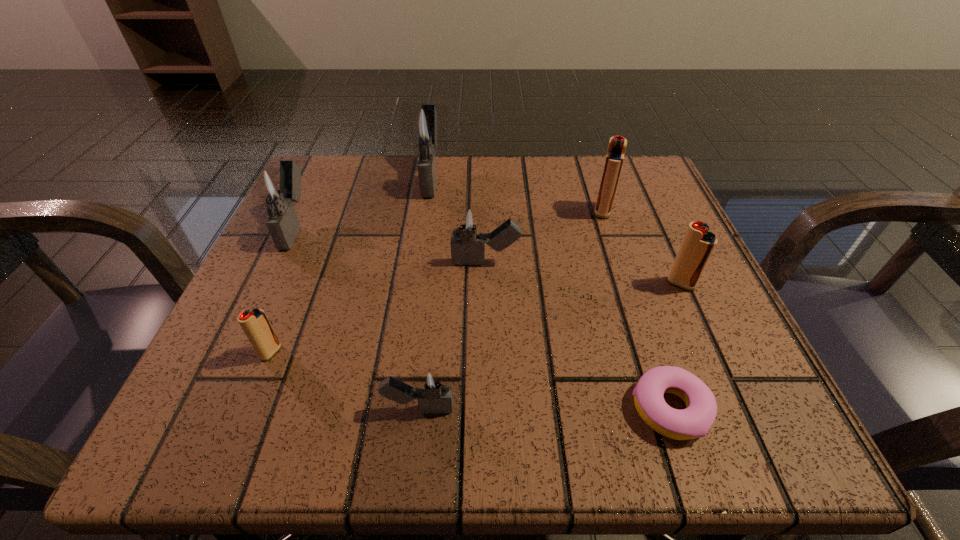
Where is `vacant area between the biggest red igniter and the nearest red igniter`? The image size is (960, 540). vacant area between the biggest red igniter and the nearest red igniter is located at coordinates (437, 281).

I want to click on vacant point located between the smallest gray igniter and the second nearest red igniter, so click(550, 346).

This screenshot has height=540, width=960. What are the coordinates of `free space that is in between the tallest object and the shortest object` in the screenshot? It's located at (551, 293).

I want to click on blank region between the smallest gray igniter and the farthest object, so click(425, 292).

Locate which object ranks fifth in proximity to the biggest red igniter. Please provide its 2D coordinates. Your answer should be formatted as a tuple, i.e. [(x, y)], where the tuple contains the x and y coordinates of a point satisfying the conditions above.

[(433, 391)]

Identify which object is located as the nearest to the farthest red igniter. Please provide its 2D coordinates. Your answer should be formatted as a tuple, i.e. [(x, y)], where the tuple contains the x and y coordinates of a point satisfying the conditions above.

[(698, 244)]

Point out which igniter is positioned as the second nearest to the second smallest gray igniter. Please provide its 2D coordinates. Your answer should be formatted as a tuple, i.e. [(x, y)], where the tuple contains the x and y coordinates of a point satisfying the conditions above.

[(617, 145)]

Choose which igniter is the second nearest neighbor to the nearest igniter. Please provide its 2D coordinates. Your answer should be formatted as a tuple, i.e. [(x, y)], where the tuple contains the x and y coordinates of a point satisfying the conditions above.

[(466, 222)]

Find the location of a particular element. The height and width of the screenshot is (540, 960). gray igniter that is the second nearest to the second nearest red igniter is located at coordinates (433, 391).

Locate which gray igniter is the third closest to the nearest gray igniter. Please provide its 2D coordinates. Your answer should be formatted as a tuple, i.e. [(x, y)], where the tuple contains the x and y coordinates of a point satisfying the conditions above.

[(423, 126)]